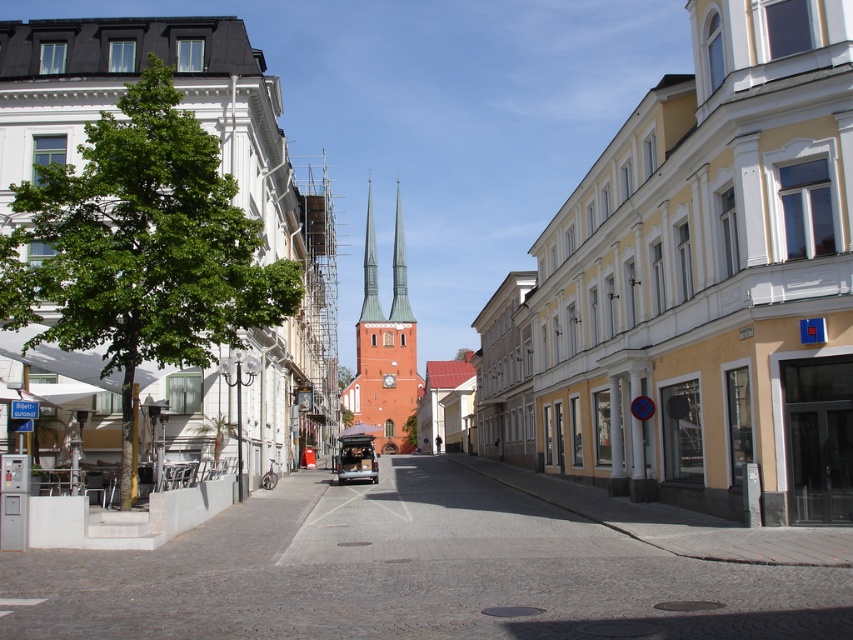
Question: Can you confirm if red brick spire at center is positioned above metallic silver van at center?

Choices:
 (A) yes
 (B) no

Answer: (A)

Question: Which point is closer to the camera?

Choices:
 (A) red brick spire at center
 (B) yellow painted building at right

Answer: (B)

Question: Which object appears farthest from the camera in this image?

Choices:
 (A) yellow painted building at right
 (B) metallic silver van at center
 (C) red brick spire at center

Answer: (C)

Question: Is yellow painted building at right wider than metallic silver van at center?

Choices:
 (A) no
 (B) yes

Answer: (B)

Question: Which of these objects is positioned farthest from the metallic silver van at center?

Choices:
 (A) red brick spire at center
 (B) yellow painted building at right

Answer: (A)

Question: Does yellow painted building at right have a smaller size compared to metallic silver van at center?

Choices:
 (A) no
 (B) yes

Answer: (A)